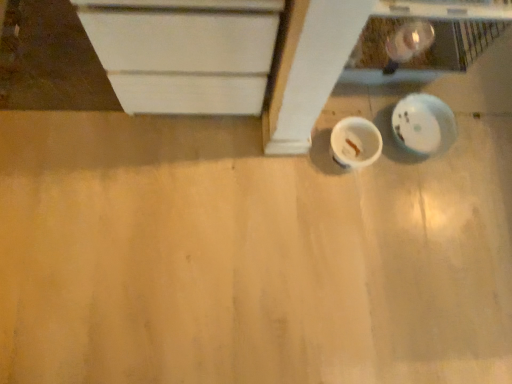
Locate an element on the screen. This screenshot has width=512, height=384. free location to the right of white glossy plate at lower right is located at coordinates (480, 147).